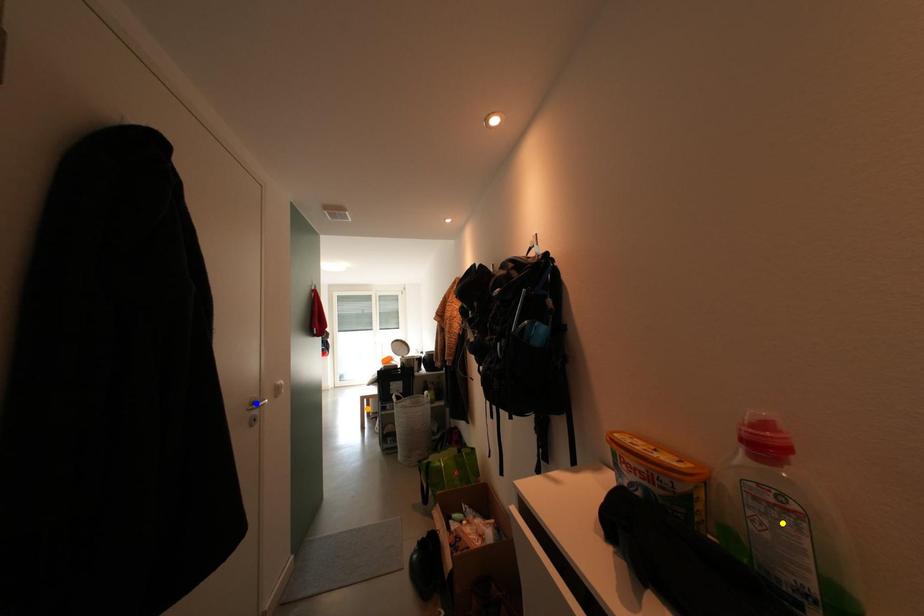
Order these from farthest to nearest:
orange point, blue point, yellow point

orange point
blue point
yellow point